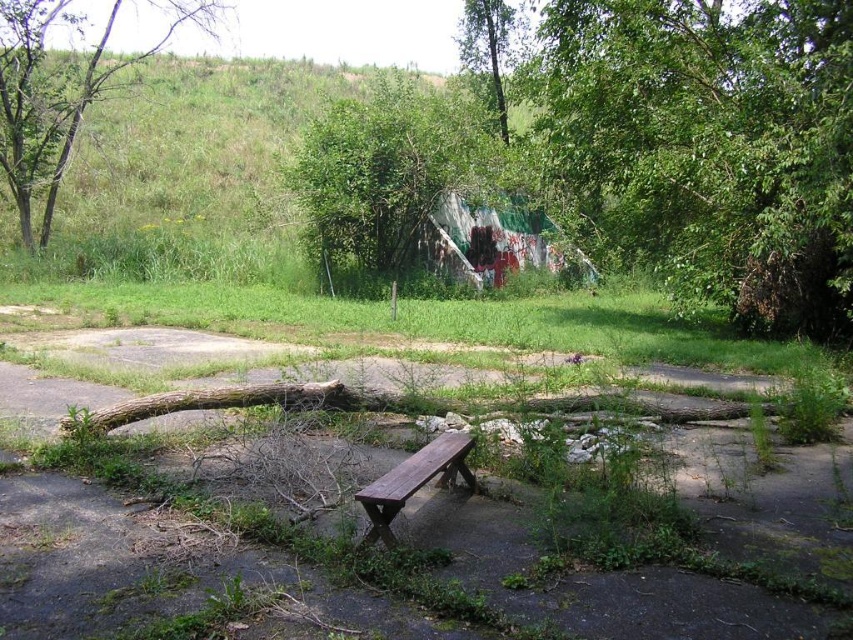
Question: Does green leafy tree at upper right lie in front of green leafy tree at center?

Choices:
 (A) yes
 (B) no

Answer: (A)

Question: Can you confirm if green leafy tree at upper right is positioned to the left of brown wooden bench at center?

Choices:
 (A) no
 (B) yes

Answer: (A)

Question: Which point is farther to the camera?

Choices:
 (A) (488, 76)
 (B) (822, 509)

Answer: (A)

Question: Does green leafy tree at upper left have a greater width compared to green leafy tree at upper center?

Choices:
 (A) yes
 (B) no

Answer: (A)

Question: Which object appears farthest from the camera in this image?

Choices:
 (A) wooden bench at center
 (B) brown wooden bench at center
 (C) green leafy tree at upper right
 (D) green leafy tree at upper center

Answer: (D)

Question: Which point is farther to the camera?

Choices:
 (A) (778, 120)
 (B) (51, 147)

Answer: (B)